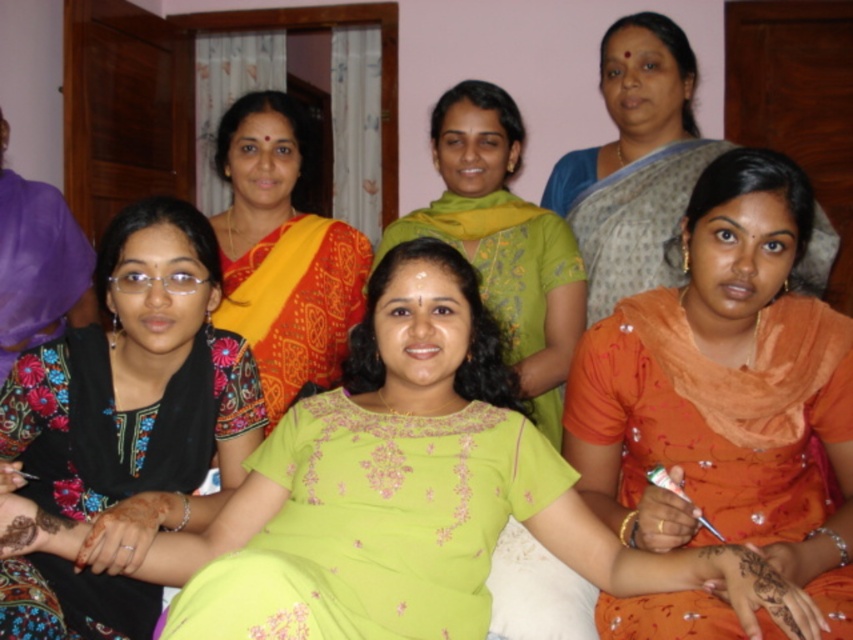
Question: Is yellow-orange sari at center further to the viewer compared to green embroidered blouse at center?

Choices:
 (A) yes
 (B) no

Answer: (B)

Question: Does floral fabric blouse at center come in front of matte orange sari at right?

Choices:
 (A) no
 (B) yes

Answer: (B)

Question: Which object appears farthest from the camera in this image?

Choices:
 (A) floral fabric blouse at center
 (B) matte purple scarf at left
 (C) orange satin saree at lower right

Answer: (B)

Question: Which point is farther from the camera taking this photo?

Choices:
 (A) (85, 276)
 (B) (225, 144)
 (C) (601, 220)

Answer: (A)

Question: Does floral fabric blouse at center appear under matte orange sari at right?

Choices:
 (A) no
 (B) yes

Answer: (B)

Question: Which point is farther from the camera taking this photo?

Choices:
 (A) (780, 400)
 (B) (604, 176)

Answer: (B)